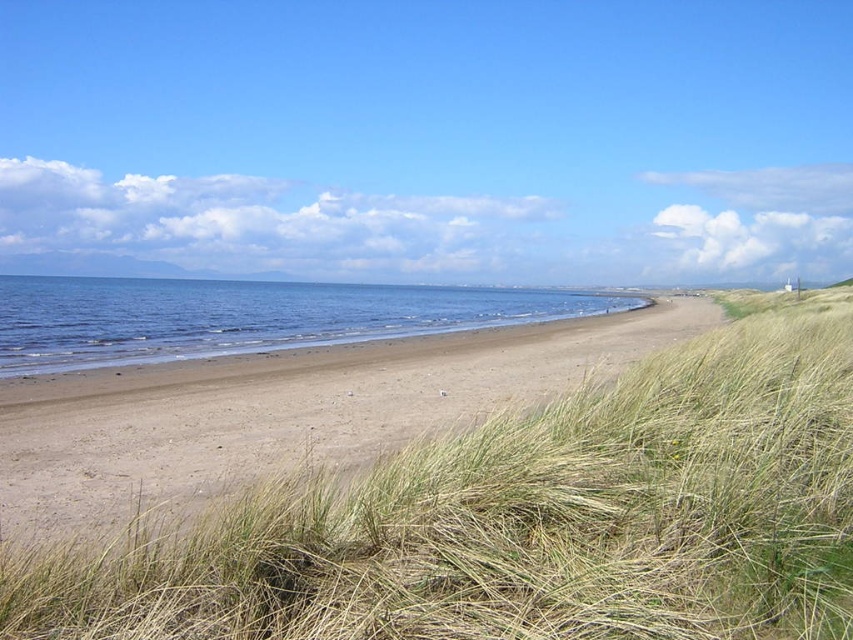
Is point (809, 513) closer to camera compared to point (316, 292)?

Yes.

Identify the location of dry grass at lower left. (448, 486).